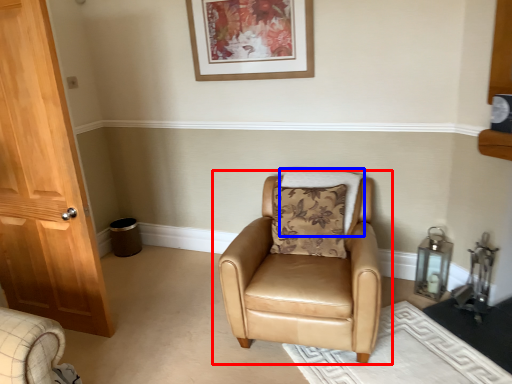
Question: Which point is closer to the camera, chair (highlighted by a red box) or pillow (highlighted by a blue box)?

Choices:
 (A) chair
 (B) pillow

Answer: (A)